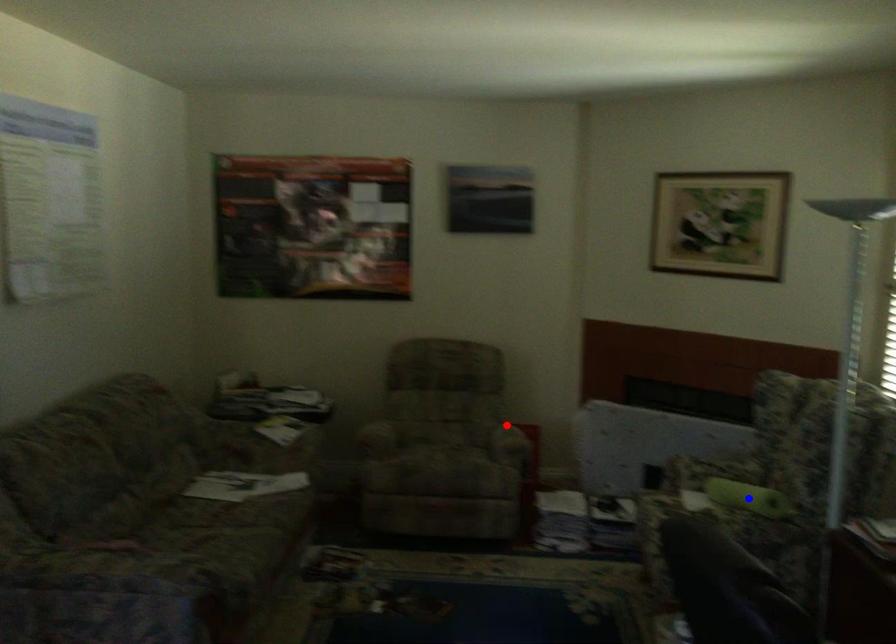
Question: Two points are marked on the image. Which point is closer to the camera?

Choices:
 (A) Blue point is closer.
 (B) Red point is closer.

Answer: (A)